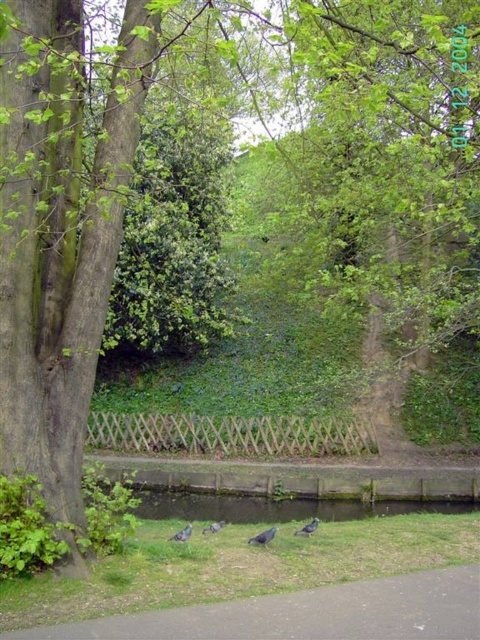
You are standing at the point labeled as point (309,612) in the park. Looking around, you notice a wooden picket fence and a grassy area with pigeons. Which direction should you walk to reach the wooden picket fence first?

The wooden picket fence is located along the edge of the water body that runs parallel to the asphalt path. Since the point (309,612) is on the brown asphalt path at lower center, walking towards the upper direction would lead you towards the fence first.

You are standing at the bottom right corner of the park and want to reach the green concrete water at lower center. What is the shortest path you can take?

The shortest path would be to follow the paved pathway curving from the bottom right corner towards the center of the frame, as it leads directly to the green concrete water at lower center.

You are a delivery drone flying over a park. You need to land on the brown asphalt path at lower center to drop off a package. However, there is a green concrete water at lower center nearby. Will the drone land safely on the path without touching the water?

The brown asphalt path at lower center is located above green concrete water at lower center, so the drone can land safely on the path without touching the water.